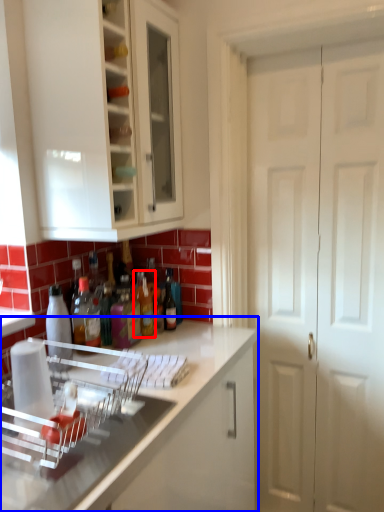
Question: Which object is closer to the camera taking this photo, bottle (highlighted by a red box) or countertop (highlighted by a blue box)?

Choices:
 (A) bottle
 (B) countertop

Answer: (B)